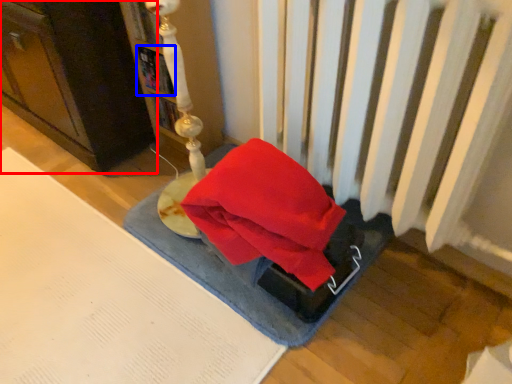
Question: Which object appears closest to the camera in this image, furniture (highlighted by a red box) or book (highlighted by a blue box)?

Choices:
 (A) furniture
 (B) book

Answer: (A)